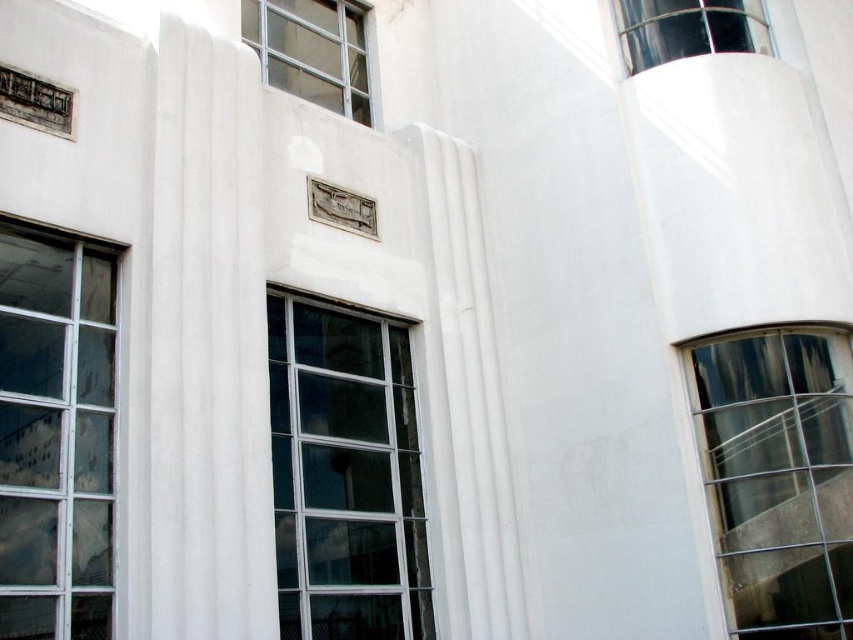
Between white marble pillar at center and clear glass window at center, which one is positioned lower?

clear glass window at center is below.

Identify the location of white marble pillar at center. (207, 346).

Is clear glass window at left bigger than clear glass window at upper center?

Yes.

Locate an element on the screen. The width and height of the screenshot is (853, 640). clear glass window at left is located at coordinates coord(55,436).

The width and height of the screenshot is (853, 640). In order to click on clear glass window at left in this screenshot , I will do `click(55, 436)`.

Does point (265, 538) lie in front of point (331, 97)?

Yes, point (265, 538) is closer to viewer.

Is white marble pillar at center wider than clear glass window at upper center?

No, white marble pillar at center is not wider than clear glass window at upper center.

Between point (163, 509) and point (331, 32), which one is positioned behind?

The point (331, 32) is behind.

The height and width of the screenshot is (640, 853). In order to click on white marble pillar at center in this screenshot , I will do `click(207, 346)`.